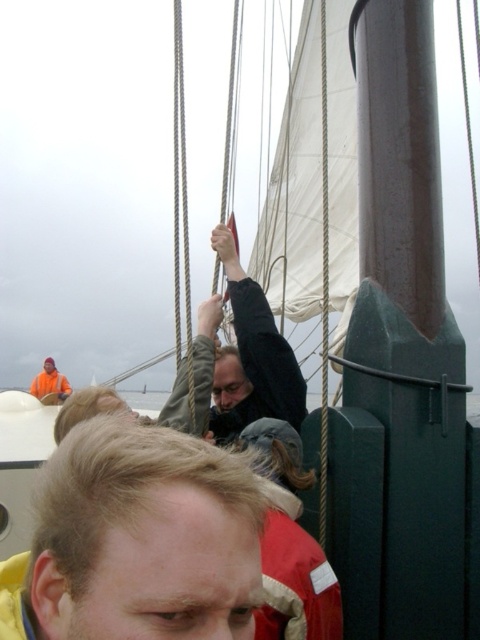
You are a sailor on deck and need to secure a rope. You see the blonde hair at lower left and the dark gray fabric at center. Which object is shorter in height?

The blonde hair at lower left is shorter than the dark gray fabric at center.

You are a photographer on the deck of a sailing vessel and want to capture a closeup shot of the blonde hair at lower left. Based on the coordinates provided, where should you aim your camera?

You should aim your camera at point (137,540) to capture the blonde hair at lower left.

You are a sailor on the deck of the ship and you see the blonde hair at lower left and the red fleece life jacket at lower center. Which object is located higher up on the deck?

The blonde hair at lower left is positioned over the red fleece life jacket at lower center, so the blonde hair at lower left is higher up.